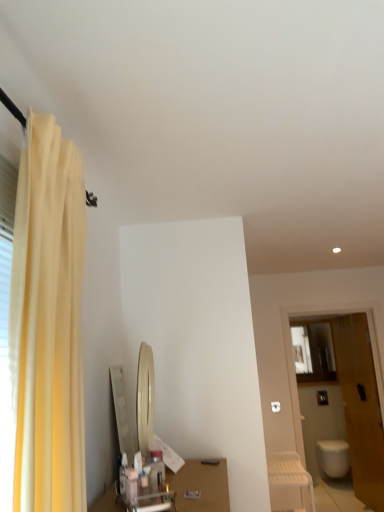
Question: Does wooden door at right have a lesser width compared to yellow fabric curtain at left?

Choices:
 (A) yes
 (B) no

Answer: (A)

Question: Can you confirm if wooden door at right is wider than yellow fabric curtain at left?

Choices:
 (A) no
 (B) yes

Answer: (A)

Question: From a real-world perspective, is wooden door at right positioned under yellow fabric curtain at left based on gravity?

Choices:
 (A) no
 (B) yes

Answer: (B)

Question: Is wooden door at right positioned with its back to yellow fabric curtain at left?

Choices:
 (A) yes
 (B) no

Answer: (B)

Question: Can you see wooden door at right touching yellow fabric curtain at left?

Choices:
 (A) yes
 (B) no

Answer: (B)

Question: From the image's perspective, is yellow fabric curtain at left above or below matte glass medicine cabinet at right?

Choices:
 (A) above
 (B) below

Answer: (A)

Question: Considering the positions of yellow fabric curtain at left and matte glass medicine cabinet at right in the image, is yellow fabric curtain at left wider or thinner than matte glass medicine cabinet at right?

Choices:
 (A) wide
 (B) thin

Answer: (A)

Question: From a real-world perspective, is yellow fabric curtain at left above or below matte glass medicine cabinet at right?

Choices:
 (A) below
 (B) above

Answer: (B)

Question: Is yellow fabric curtain at left bigger or smaller than matte glass medicine cabinet at right?

Choices:
 (A) small
 (B) big

Answer: (B)

Question: Looking at their shapes, would you say wooden door at right is wider or thinner than white plastic chair at lower right?

Choices:
 (A) thin
 (B) wide

Answer: (A)

Question: Visually, is wooden door at right positioned to the left or to the right of white plastic chair at lower right?

Choices:
 (A) left
 (B) right

Answer: (B)

Question: Considering their positions, is wooden door at right located in front of or behind white plastic chair at lower right?

Choices:
 (A) behind
 (B) front

Answer: (A)

Question: From the image's perspective, is wooden door at right located above or below white plastic chair at lower right?

Choices:
 (A) below
 (B) above

Answer: (B)

Question: Is point (350, 439) positioned closer to the camera than point (66, 265)?

Choices:
 (A) farther
 (B) closer

Answer: (A)

Question: Considering their positions, is wooden door at right located in front of or behind yellow fabric curtain at left?

Choices:
 (A) front
 (B) behind

Answer: (B)